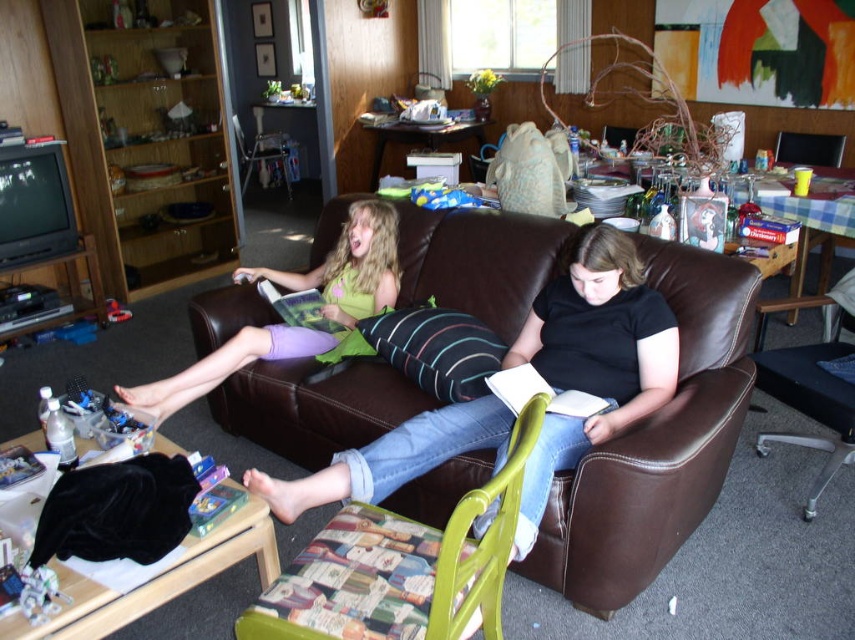
Question: Does matte green fabric at center have a lesser width compared to brown leather armchair at right?

Choices:
 (A) yes
 (B) no

Answer: (B)

Question: Which point is closer to the camera?

Choices:
 (A) (793, 376)
 (B) (446, 616)
 (C) (261, 276)

Answer: (B)

Question: Can you confirm if brown leather couch at center is smaller than brown leather armchair at right?

Choices:
 (A) yes
 (B) no

Answer: (B)

Question: Which object appears closest to the camera in this image?

Choices:
 (A) brown leather couch at center
 (B) green fabric chair at lower center

Answer: (B)

Question: Which of the following is the farthest from the observer?

Choices:
 (A) brown leather armchair at right
 (B) brown leather couch at center
 (C) matte green fabric at center
 (D) green fabric chair at lower center

Answer: (C)

Question: Is matte green fabric at center to the left of brown leather armchair at right from the viewer's perspective?

Choices:
 (A) no
 (B) yes

Answer: (B)